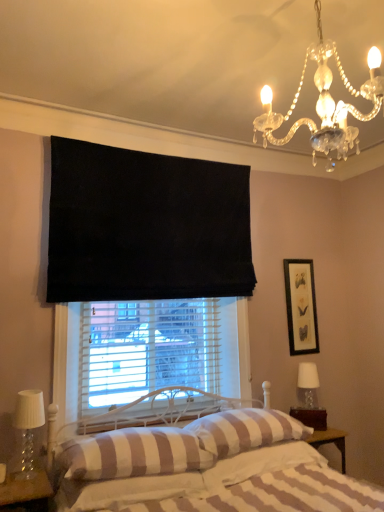
Question: Is striped fabric pillow at center, which is the 3th pillow in left-to-right order, positioned before striped cotton sheet at lower center?

Choices:
 (A) yes
 (B) no

Answer: (B)

Question: Is striped fabric pillow at center, arranged as the 1th pillow when viewed from the right, further to camera compared to striped cotton sheet at lower center?

Choices:
 (A) yes
 (B) no

Answer: (A)

Question: Is striped fabric pillow at center, arranged as the 1th pillow when viewed from the right, not within striped cotton sheet at lower center?

Choices:
 (A) yes
 (B) no

Answer: (A)

Question: Is striped fabric pillow at center, which is the 3th pillow in left-to-right order, turned away from striped cotton sheet at lower center?

Choices:
 (A) yes
 (B) no

Answer: (B)

Question: Is striped fabric pillow at center, arranged as the 1th pillow when viewed from the right, thinner than striped cotton sheet at lower center?

Choices:
 (A) yes
 (B) no

Answer: (B)

Question: Is striped fabric pillow at center, arranged as the 1th pillow when viewed from the right, oriented towards striped cotton sheet at lower center?

Choices:
 (A) yes
 (B) no

Answer: (B)

Question: Considering the relative sizes of striped fabric pillow at center, arranged as the 1th pillow when viewed from the right, and striped fabric pillow at lower center, acting as the first pillow starting from the left, in the image provided, is striped fabric pillow at center, arranged as the 1th pillow when viewed from the right, taller than striped fabric pillow at lower center, acting as the first pillow starting from the left,?

Choices:
 (A) yes
 (B) no

Answer: (B)

Question: Is striped fabric pillow at center, which is the 3th pillow in left-to-right order, closer to the viewer compared to striped fabric pillow at lower center, which is the 3th pillow in right-to-left order?

Choices:
 (A) no
 (B) yes

Answer: (A)

Question: Is striped fabric pillow at center, arranged as the 1th pillow when viewed from the right, further to camera compared to striped fabric pillow at lower center, which is the 3th pillow in right-to-left order?

Choices:
 (A) yes
 (B) no

Answer: (A)

Question: Could you tell me if striped fabric pillow at center, which is the 3th pillow in left-to-right order, is turned towards striped fabric pillow at lower center, acting as the first pillow starting from the left?

Choices:
 (A) yes
 (B) no

Answer: (B)

Question: Does striped fabric pillow at center, which is the 3th pillow in left-to-right order, touch striped fabric pillow at lower center, which is the 3th pillow in right-to-left order?

Choices:
 (A) no
 (B) yes

Answer: (A)

Question: Is striped fabric pillow at center, arranged as the 1th pillow when viewed from the right, to the left of striped fabric pillow at lower center, which is the 3th pillow in right-to-left order, from the viewer's perspective?

Choices:
 (A) yes
 (B) no

Answer: (B)

Question: Are black matte picture frame at upper right and striped fabric pillow at center, arranged as the 1th pillow when viewed from the right, located far from each other?

Choices:
 (A) no
 (B) yes

Answer: (B)